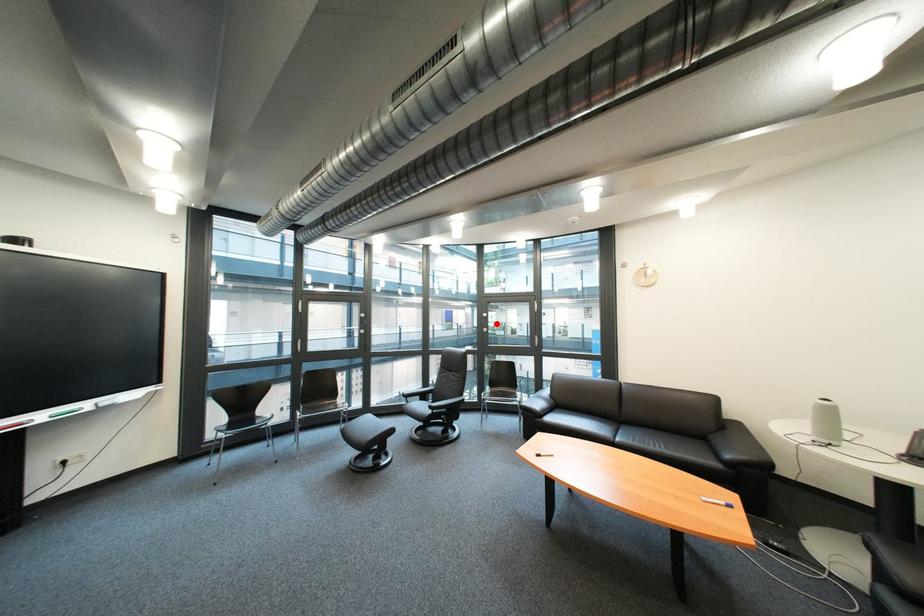
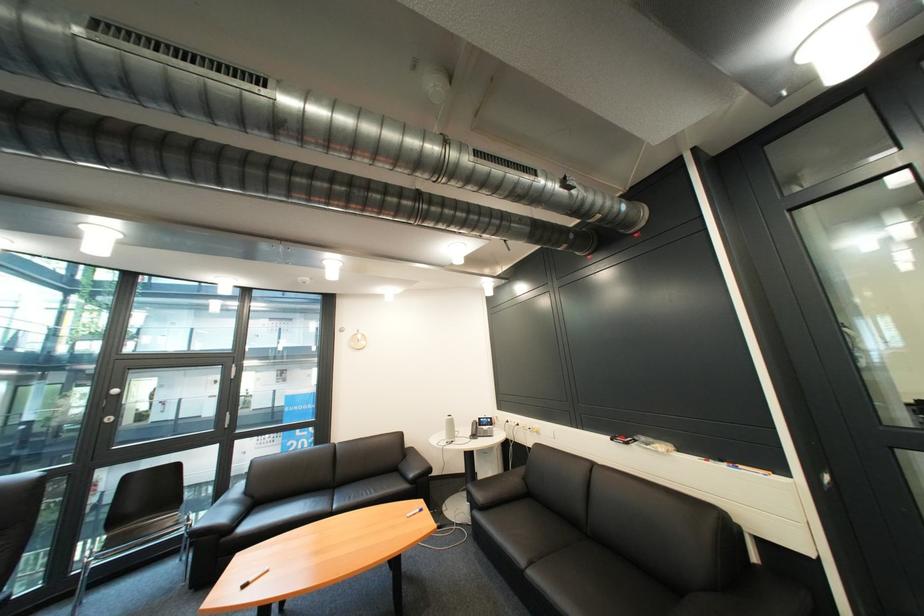
Question: I am providing you with two images of the same scene from different viewpoints. A red point is marked on the first image. Can you still see the location of the red point in image 2?

Choices:
 (A) Yes
 (B) No

Answer: (A)